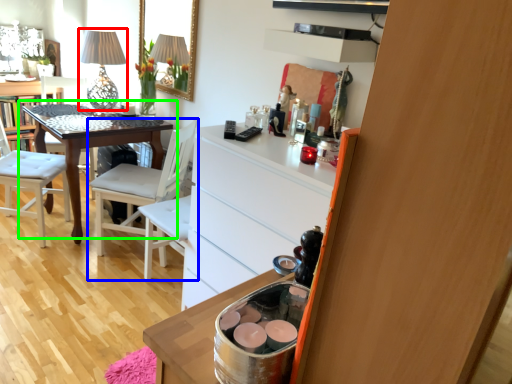
Question: Which object is the farthest from table lamp (highlighted by a red box)? Choose among these: chair (highlighted by a blue box) or table (highlighted by a green box).

Choices:
 (A) chair
 (B) table

Answer: (A)